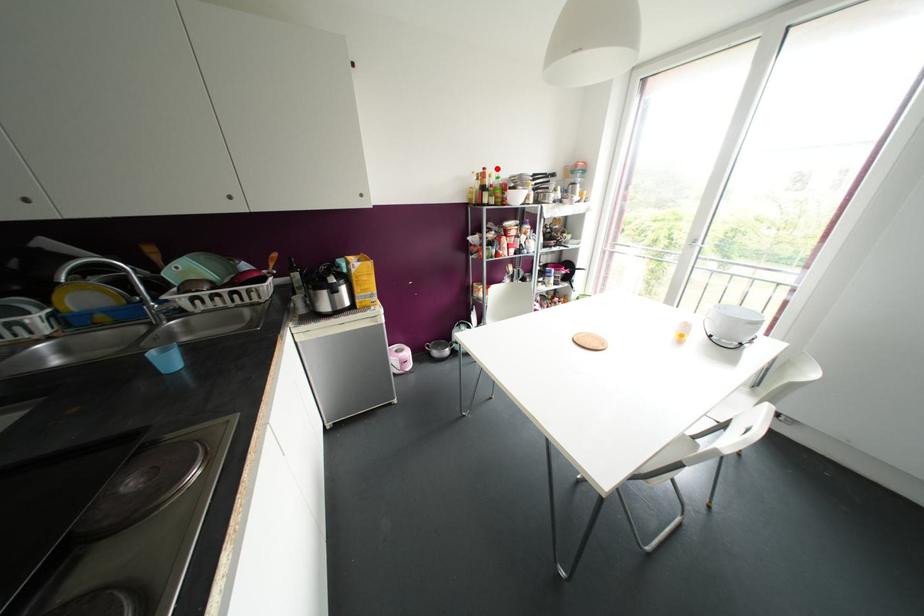
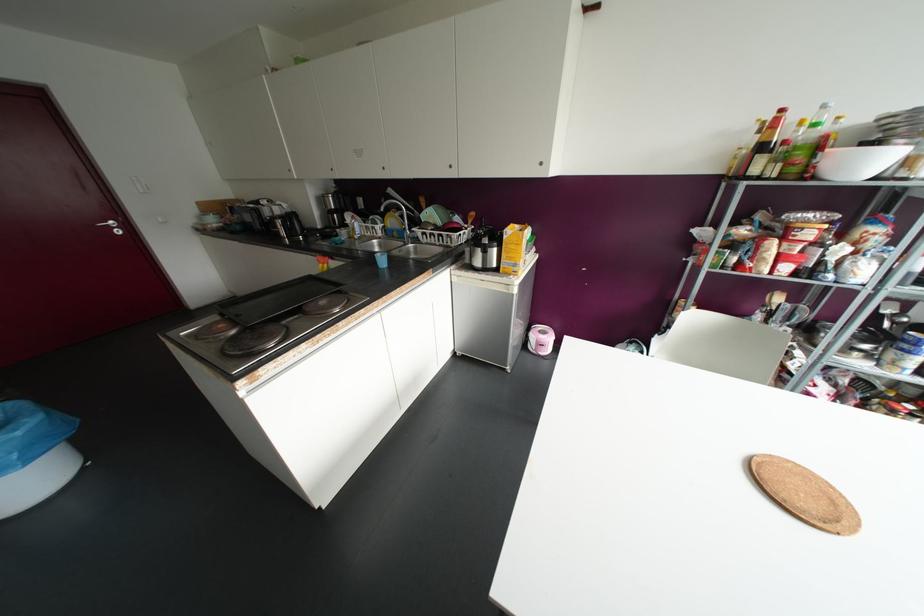
Question: I am providing you with two images of the same scene from different viewpoints. Given a red point in image1, look at the same physical point in image2. Is it:

Choices:
 (A) Closer to the viewpoint
 (B) Farther from the viewpoint

Answer: (B)